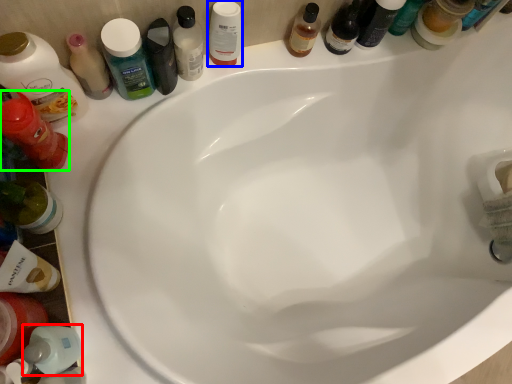
Question: Which object is positioned closest to toiletry (highlighted by a red box)? Select from mouthwash (highlighted by a blue box) and toiletry (highlighted by a green box).

Choices:
 (A) mouthwash
 (B) toiletry

Answer: (B)